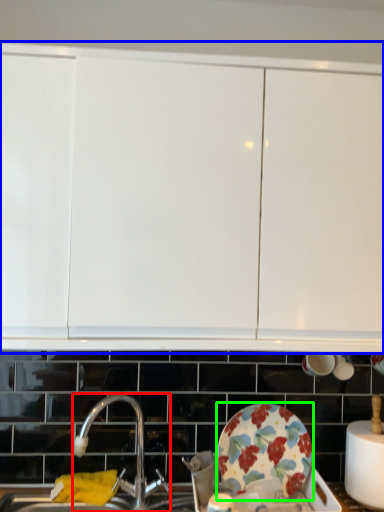
Question: Based on their relative distances, which object is nearer to tap (highlighted by a red box)? Choose from cabinetry (highlighted by a blue box) and plate (highlighted by a green box).

Choices:
 (A) cabinetry
 (B) plate

Answer: (B)